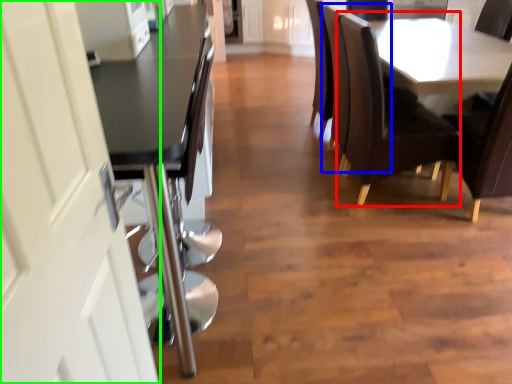
Question: Which is farther away from chair (highlighted by a red box)? armchair (highlighted by a blue box) or screen door (highlighted by a green box)?

Choices:
 (A) armchair
 (B) screen door

Answer: (B)